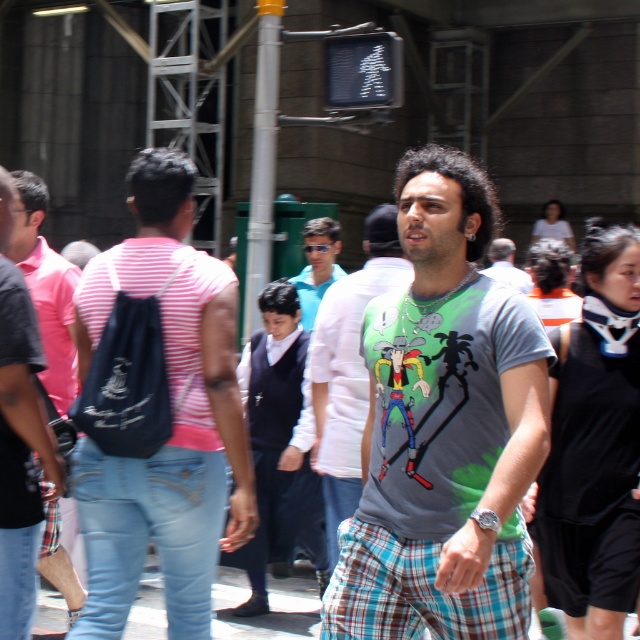
Which is more to the right, gray printed t-shirt at center or green printed t-shirt at center?

From the viewer's perspective, gray printed t-shirt at center appears more on the right side.

Does point (541, 385) come in front of point (380, 209)?

That is True.

This screenshot has height=640, width=640. Describe the element at coordinates (444, 429) in the screenshot. I see `gray printed t-shirt at center` at that location.

Where is `gray printed t-shirt at center`? The image size is (640, 640). gray printed t-shirt at center is located at coordinates (444, 429).

Is blue plaid pants at center further to the viewer compared to matte black backpack at left?

Yes, it is behind matte black backpack at left.

Who is more distant from viewer, [204,435] or [3,353]?

The point [204,435] is behind.

Which is in front, point (179, 208) or point (28, 394)?

Point (28, 394) is in front.

In order to click on blue plaid pants at center in this screenshot , I will do `click(172, 481)`.

Is gray printed t-shirt at center smaller than matte black backpack at left?

No.

Is gray printed t-shirt at center positioned at the back of matte black backpack at left?

No, gray printed t-shirt at center is closer to the viewer.

Find the location of a particular element. Image resolution: width=640 pixels, height=640 pixels. gray printed t-shirt at center is located at coordinates (444, 429).